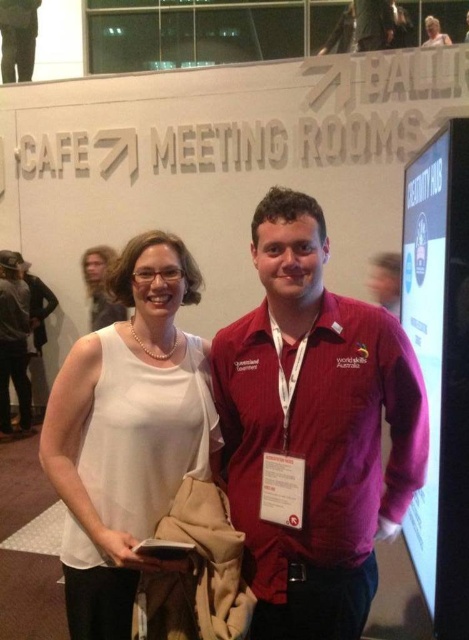
You are at the event and need to locate the person with the matte black hair at upper left. From their position, which direction should you look to find the matte red jacket at center?

The matte red jacket at center is to the right of matte black hair at upper left, so you should look to your right to find it.